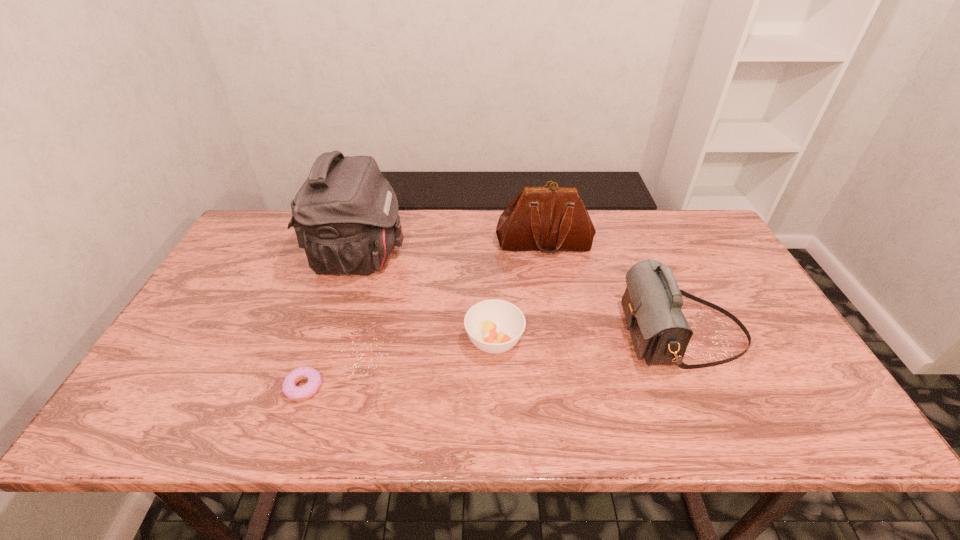
Find the location of a particular element. free space between the fourth tallest object and the shortest object is located at coordinates (399, 364).

Where is `object that stands as the second closest to the soup bowl`? object that stands as the second closest to the soup bowl is located at coordinates (548, 219).

Identify the location of object that is the second nearest to the fourth tallest object. point(548,219).

Find the location of a particular element. The height and width of the screenshot is (540, 960). shoulder bag object that ranks as the closest to the tallest object is located at coordinates (548, 219).

Where is `shoulder bag that is the second closest to the tallest shoulder bag`? The height and width of the screenshot is (540, 960). shoulder bag that is the second closest to the tallest shoulder bag is located at coordinates (652, 302).

The image size is (960, 540). Identify the location of free point that satisfies the following two spatial constraints: 1. on the open flap of the nearest shoulder bag; 2. on the left side of the tallest shoulder bag. (335, 333).

I want to click on vacant position in the image that satisfies the following two spatial constraints: 1. on the open flap of the tallest shoulder bag; 2. on the right side of the nearest shoulder bag, so click(335, 333).

Identify the location of blank space that satisfies the following two spatial constraints: 1. on the open flap of the soup bowl; 2. on the right side of the tallest object. The width and height of the screenshot is (960, 540). (332, 341).

Locate an element on the screen. free space that satisfies the following two spatial constraints: 1. on the open flap of the second shortest object; 2. on the left side of the tallest shoulder bag is located at coordinates [332, 341].

The image size is (960, 540). What are the coordinates of `vacant space that satisfies the following two spatial constraints: 1. on the back side of the soup bowl; 2. on the open flap of the tallest shoulder bag` in the screenshot? It's located at (492, 257).